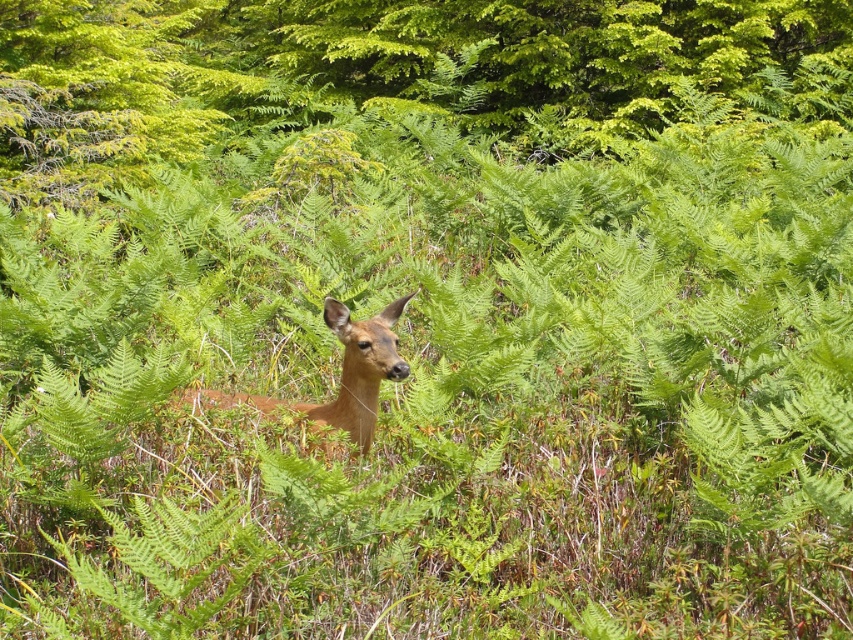
Question: Among these objects, which one is farthest from the camera?

Choices:
 (A) green leafy tree at center
 (B) brown matte/deer at center

Answer: (A)

Question: Is green leafy tree at center above brown matte/deer at center?

Choices:
 (A) yes
 (B) no

Answer: (A)

Question: Among these points, which one is nearest to the camera?

Choices:
 (A) (399, 308)
 (B) (544, 70)

Answer: (A)

Question: Can you confirm if green leafy tree at center is wider than brown matte/deer at center?

Choices:
 (A) yes
 (B) no

Answer: (B)

Question: In this image, where is green leafy tree at center located relative to brown matte/deer at center?

Choices:
 (A) left
 (B) right

Answer: (A)